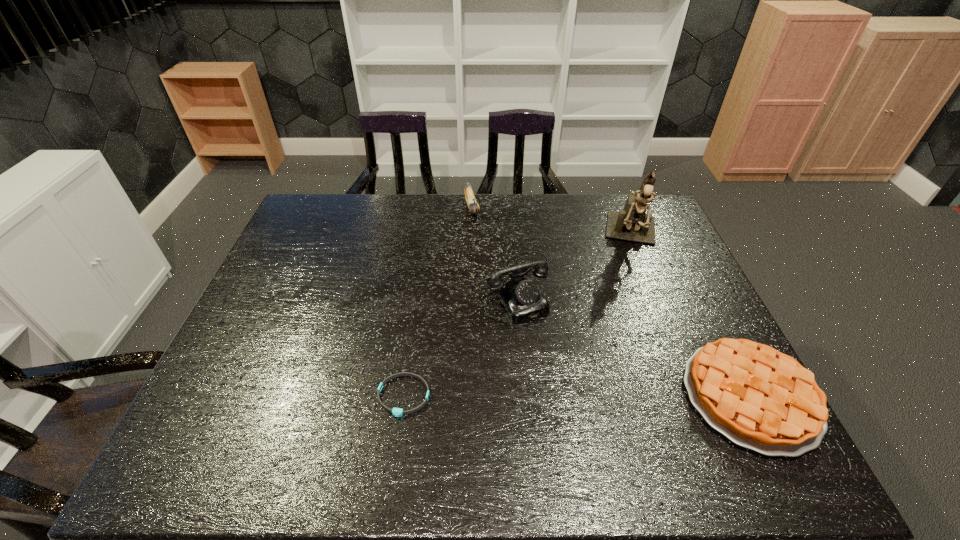
You are a GUI agent. You are given a task and a screenshot of the screen. Output one action in this format:
    pyautogui.click(x=<x>, y=<y>)
    Task: Click on the pie at the right edge
    The height and width of the screenshot is (540, 960).
    Given the screenshot: What is the action you would take?
    pyautogui.click(x=759, y=398)

You are a GUI agent. You are given a task and a screenshot of the screen. Output one action in this format:
    pyautogui.click(x=<x>, y=<y>)
    Task: Click on the figurine present at the right edge
    The height and width of the screenshot is (540, 960).
    Given the screenshot: What is the action you would take?
    pyautogui.click(x=632, y=224)

The height and width of the screenshot is (540, 960). In order to click on object positioned at the far right corner in this screenshot , I will do `click(632, 224)`.

Where is `object that is positioned at the near right corner`? The image size is (960, 540). object that is positioned at the near right corner is located at coordinates (759, 398).

This screenshot has width=960, height=540. In order to click on vacant space at the far edge of the desktop in this screenshot , I will do `click(568, 214)`.

This screenshot has width=960, height=540. What are the coordinates of `vacant region at the near edge of the desktop` in the screenshot? It's located at (395, 402).

This screenshot has height=540, width=960. In order to click on free space at the left edge of the desktop in this screenshot , I will do `click(274, 268)`.

Locate an element on the screen. The height and width of the screenshot is (540, 960). vacant space at the right edge of the desktop is located at coordinates (669, 239).

In the image, there is a desktop. Identify the location of free space at the far left corner. The image size is (960, 540). (331, 207).

In the image, there is a desktop. Identify the location of vacant region at the far right corner. (666, 234).